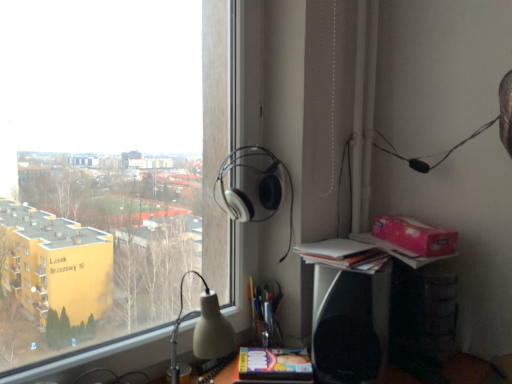
Question: Is black plastic speaker at lower right oriented away from white matte headphones at upper center?

Choices:
 (A) yes
 (B) no

Answer: (B)

Question: Is black plastic speaker at lower right at the right side of white matte headphones at upper center?

Choices:
 (A) yes
 (B) no

Answer: (A)

Question: Could white matte headphones at upper center be considered to be inside black plastic speaker at lower right?

Choices:
 (A) yes
 (B) no

Answer: (B)

Question: Is black plastic speaker at lower right oriented towards white matte headphones at upper center?

Choices:
 (A) yes
 (B) no

Answer: (B)

Question: Does black plastic speaker at lower right have a greater height compared to white matte headphones at upper center?

Choices:
 (A) no
 (B) yes

Answer: (B)

Question: From a real-world perspective, is white paper stack at right physically located above or below black plastic speaker at lower right?

Choices:
 (A) above
 (B) below

Answer: (A)

Question: From the image's perspective, is white paper stack at right positioned above or below black plastic speaker at lower right?

Choices:
 (A) above
 (B) below

Answer: (A)

Question: Looking at the image, does white paper stack at right seem bigger or smaller compared to black plastic speaker at lower right?

Choices:
 (A) big
 (B) small

Answer: (B)

Question: From their relative heights in the image, would you say white paper stack at right is taller or shorter than black plastic speaker at lower right?

Choices:
 (A) short
 (B) tall

Answer: (A)

Question: From a real-world perspective, is transparent glass window at upper left above or below matte yellow paperback book at lower center?

Choices:
 (A) below
 (B) above

Answer: (B)

Question: Is point (86, 326) closer or farther from the camera than point (266, 365)?

Choices:
 (A) farther
 (B) closer

Answer: (A)

Question: Looking at the image, does transparent glass window at upper left seem bigger or smaller compared to matte yellow paperback book at lower center?

Choices:
 (A) big
 (B) small

Answer: (A)

Question: Relative to matte yellow paperback book at lower center, is transparent glass window at upper left in front or behind?

Choices:
 (A) behind
 (B) front

Answer: (B)

Question: From the image's perspective, is white matte headphones at upper center above or below white paper stack at right?

Choices:
 (A) above
 (B) below

Answer: (A)

Question: Is point (253, 147) positioned closer to the camera than point (323, 256)?

Choices:
 (A) closer
 (B) farther

Answer: (B)